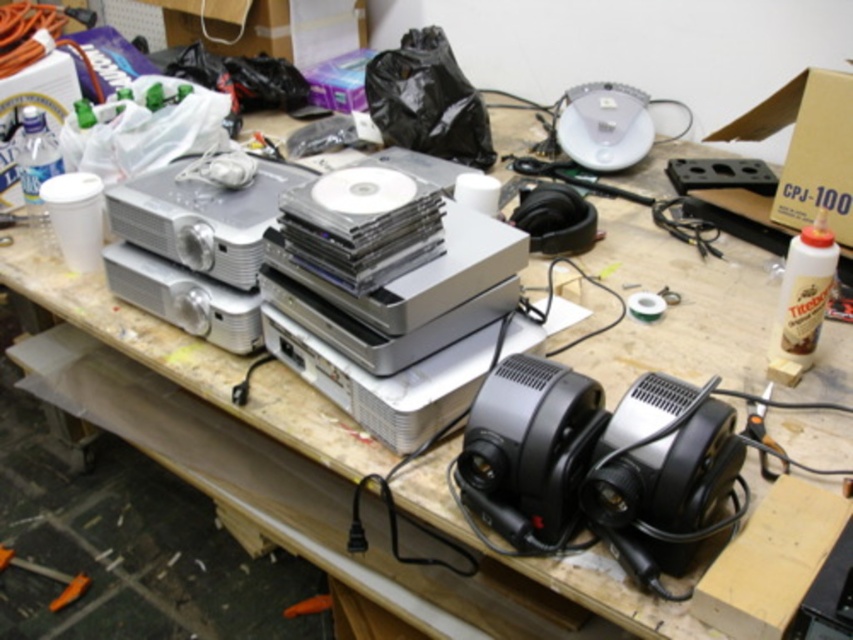
In the scene shown: You are setting up a presentation in the workshop and need to place both the black plastic speaker at center and the silver metallic projector at center on a shelf. The shelf has limited vertical space. Which object should you place first to ensure both fit vertically?

A: The silver metallic projector at center is shorter than the black plastic speaker at center. To ensure both fit vertically on the shelf, place the taller black plastic speaker at center first, then the shorter silver metallic projector at center.